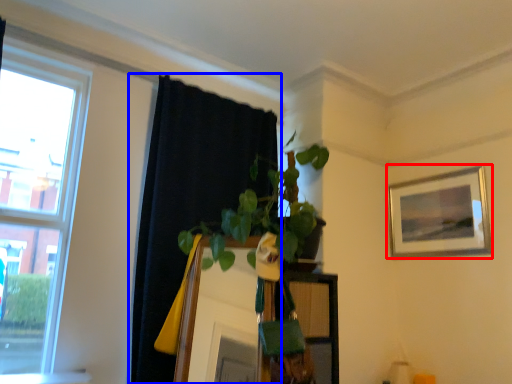
Question: Among these objects, which one is farthest to the camera, picture frame (highlighted by a red box) or curtain (highlighted by a blue box)?

Choices:
 (A) picture frame
 (B) curtain

Answer: (A)